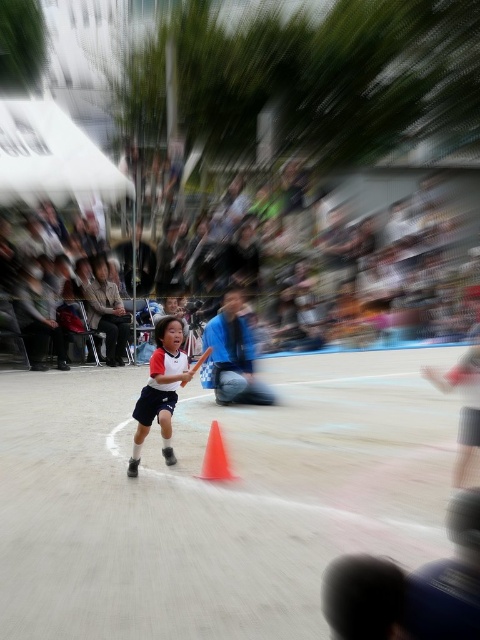
You are a photographer at the event and want to capture a closeup of the blue fabric at center and the matte white shirt at center. Which object should you zoom in on first to ensure it appears larger in the photo?

The blue fabric at center is taller than the matte white shirt at center, so you should zoom in on the blue fabric at center first to ensure it appears larger in the photo.

You are a photographer at a relay race event. You notice a matte white shirt at center and a light brown fabric chair at center in your camera viewfinder. Which object is closer to the camera lens?

The matte white shirt at center is located below the light brown fabric chair at center. Since it is positioned lower in the frame, it is closer to the camera lens compared to the chair.